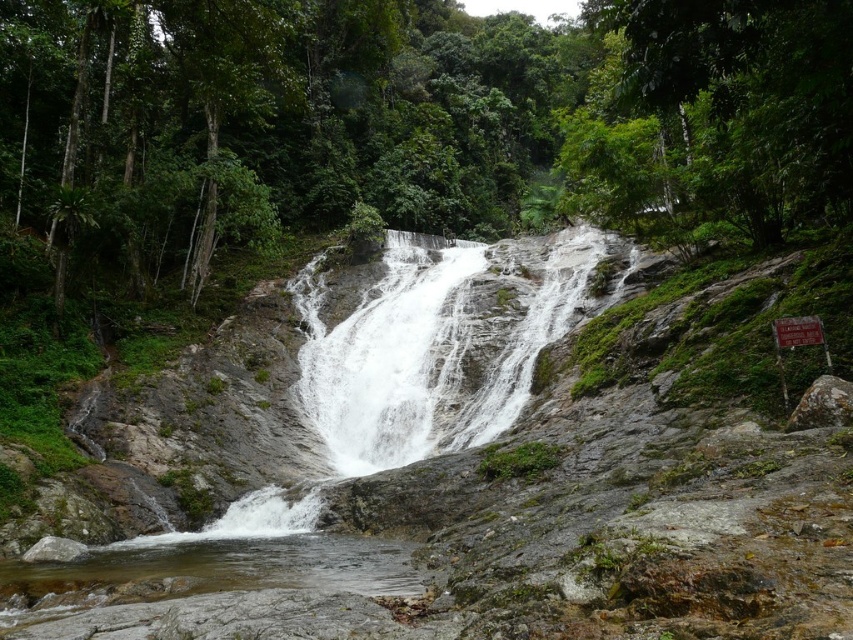
Question: Can you confirm if white textured waterfall at center is bigger than gray rough rock at right?

Choices:
 (A) no
 (B) yes

Answer: (B)

Question: Which of these objects is positioned farthest from the gray smooth rock at lower left?

Choices:
 (A) white textured waterfall at center
 (B) gray rough rock at right

Answer: (A)

Question: From the image, what is the correct spatial relationship of gray rough rock at right in relation to gray smooth rock at lower left?

Choices:
 (A) above
 (B) below

Answer: (A)

Question: Which object appears farthest from the camera in this image?

Choices:
 (A) gray smooth rock at lower left
 (B) gray rough rock at right
 (C) white textured waterfall at center

Answer: (C)

Question: Which object appears closest to the camera in this image?

Choices:
 (A) gray smooth rock at lower left
 (B) gray rough rock at right
 (C) white textured waterfall at center

Answer: (B)

Question: Does white textured waterfall at center come behind gray smooth rock at lower left?

Choices:
 (A) no
 (B) yes

Answer: (B)